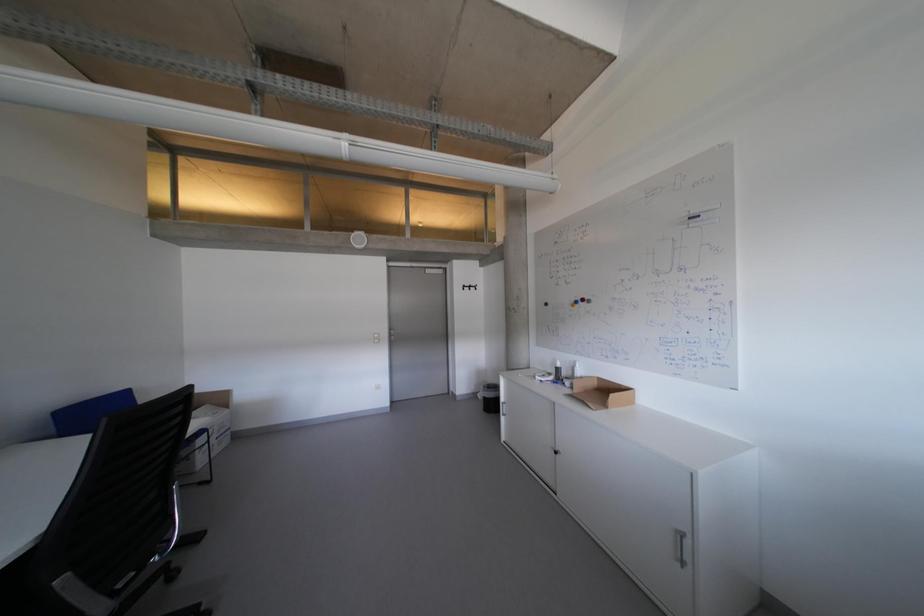
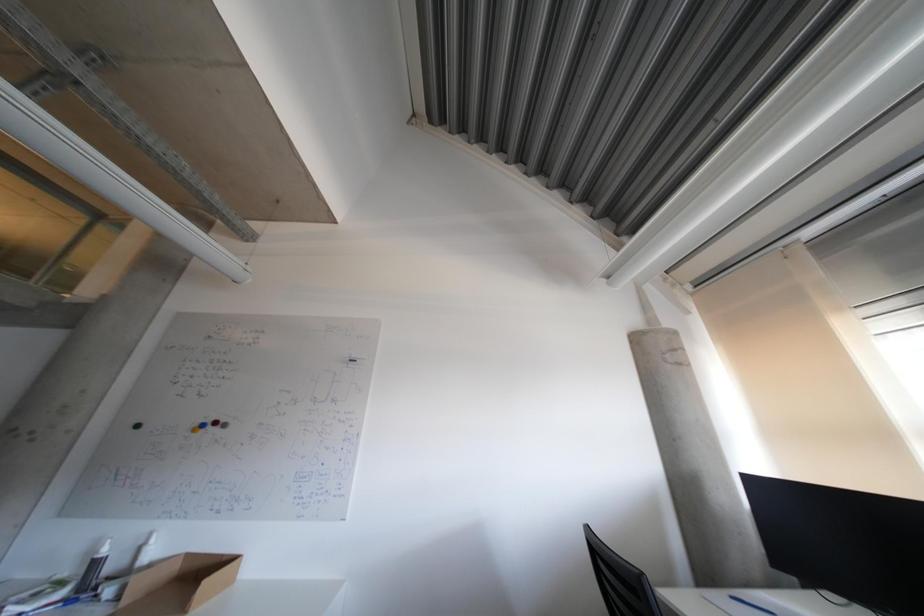
Based on the continuous images, in which direction is the camera rotating?

The camera rotated toward right-up.